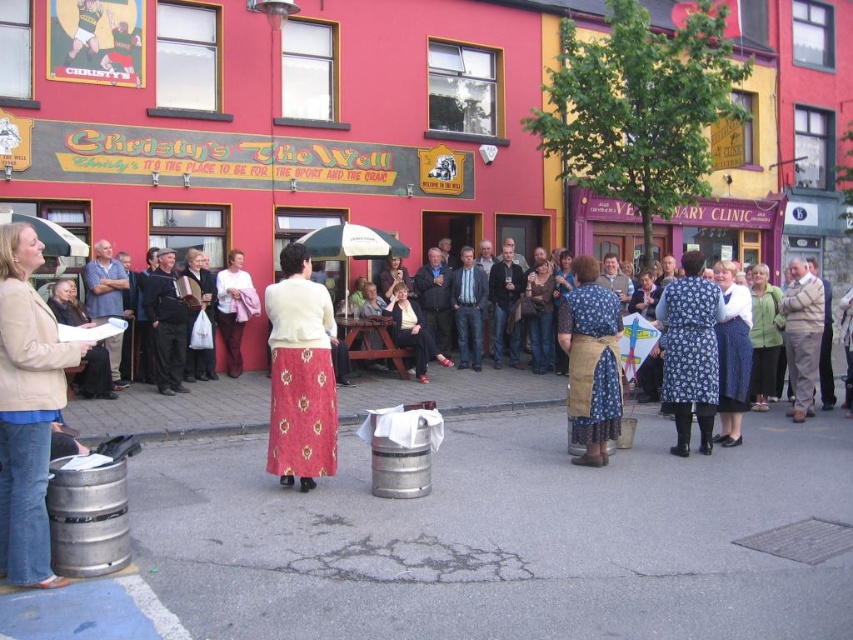
Question: Which of the following is the farthest from the observer?

Choices:
 (A) (660, 340)
 (B) (231, 294)

Answer: (B)

Question: Does floral fabric skirt at center appear under dark brown leather jacket at center?

Choices:
 (A) yes
 (B) no

Answer: (A)

Question: Which point appears closest to the camera in this image?

Choices:
 (A) (239, 353)
 (B) (1, 252)
 (C) (125, 282)
 (D) (724, 376)

Answer: (B)

Question: Does denim jacket at lower left have a lesser width compared to light beige sweater at center?

Choices:
 (A) no
 (B) yes

Answer: (B)

Question: Which point is closer to the camera?

Choices:
 (A) floral fabric skirt at center
 (B) brown wool sweater at center
 (C) floral fabric apron at center
 (D) floral-patterned dress at center-right

Answer: (A)

Question: Is blue floral dress at center to the left of light beige sweater at center from the viewer's perspective?

Choices:
 (A) no
 (B) yes

Answer: (A)